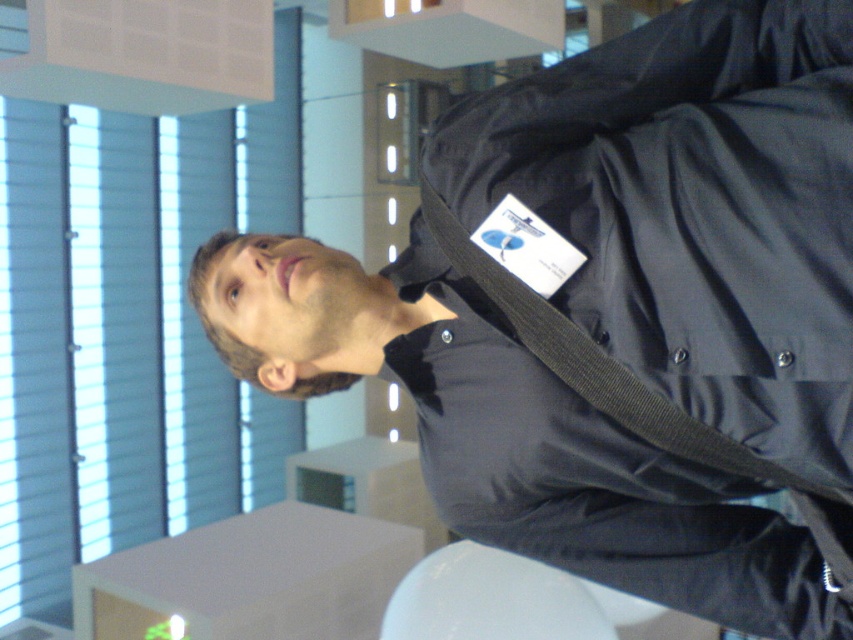
The width and height of the screenshot is (853, 640). I want to click on blue fabric blinds at left, so click(128, 326).

Does blue fabric blinds at left appear under black fabric strap at upper right?

No.

Based on the photo, who is more forward, (56, 396) or (676, 442)?

Positioned in front is point (676, 442).

At what (x,y) coordinates should I click in order to perform the action: click on blue fabric blinds at left. Please return your answer as a coordinate pair (x, y). Looking at the image, I should click on (128, 326).